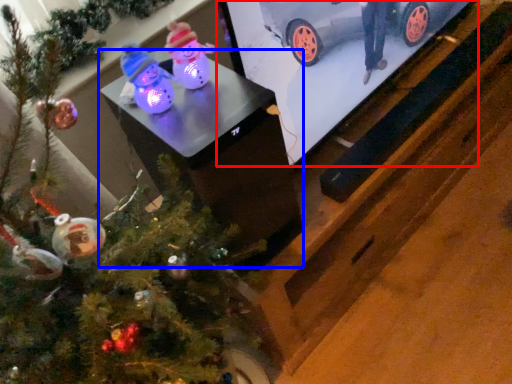
Question: Which object appears closest to the camera in this image, tv show (highlighted by a red box) or table (highlighted by a blue box)?

Choices:
 (A) tv show
 (B) table

Answer: (B)